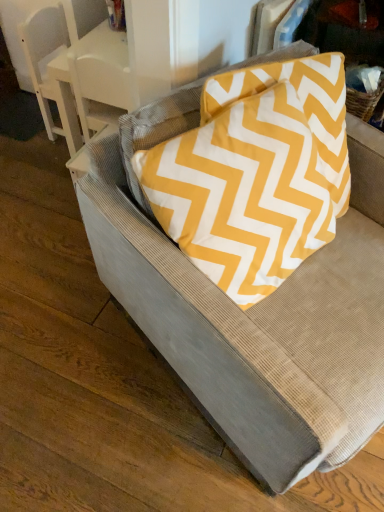
At what (x,y) coordinates should I click in order to perform the action: click on vacant space to the left of textured gray armchair at upper left. Please return your answer as a coordinate pair (x, y). This screenshot has height=512, width=384. Looking at the image, I should click on (x=23, y=130).